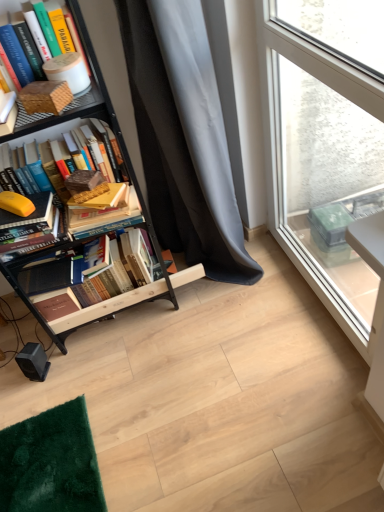
This screenshot has width=384, height=512. I want to click on vacant area in front of transparent glass window at upper right, so click(309, 395).